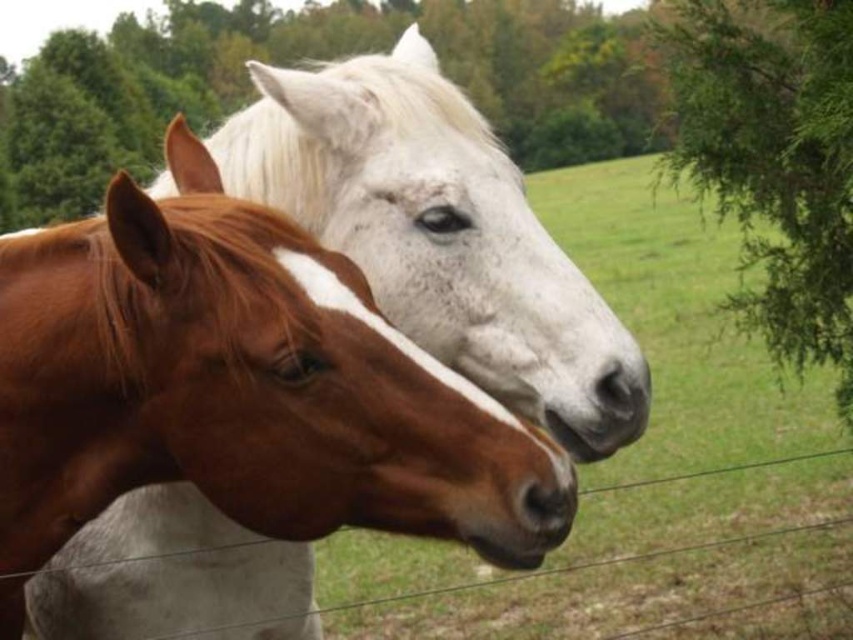
Based on the photo, you are standing in the field looking at the two horses. There are two points marked in the image. The first point is at coordinate point (x=824, y=298) and the second point is at coordinate point (x=637, y=486). If you were to walk from the first point to the second point, would you be moving towards the horses or away from them?

Since point (x=824, y=298) is in front of point (x=637, y=486), moving from the first point to the second point would mean moving away from the horses.

You are a photographer standing at the origin point in the scene. You want to capture a photo of the brown glossy horse at center. What are the coordinates of the horse?

The coordinates of the brown glossy horse at center are at point (x=241, y=388).